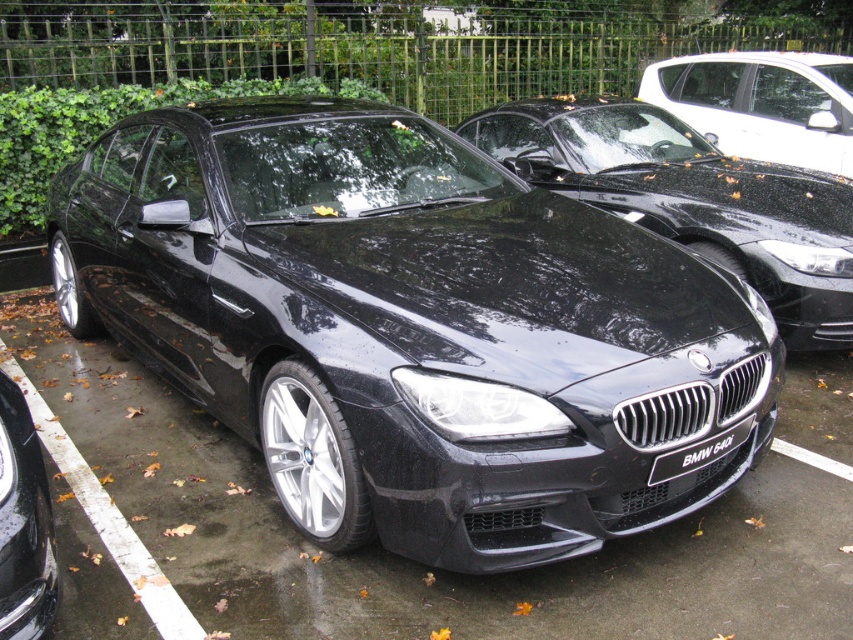
Is glossy black car at upper right wider than glossy black car at lower left?

Yes.

What do you see at coordinates (762, 104) in the screenshot? I see `glossy black car at upper right` at bounding box center [762, 104].

Image resolution: width=853 pixels, height=640 pixels. I want to click on glossy black car at upper right, so click(762, 104).

Who is positioned more to the left, glossy black car at center or glossy black car at upper right?

glossy black car at center

I want to click on glossy black car at center, so click(692, 198).

Is point (33, 440) closer to viewer compared to point (659, 465)?

Yes, it is.

Is point (16, 576) behind point (753, 419)?

No, it is not.

Identify the location of glossy black car at lower left. The width and height of the screenshot is (853, 640). (22, 524).